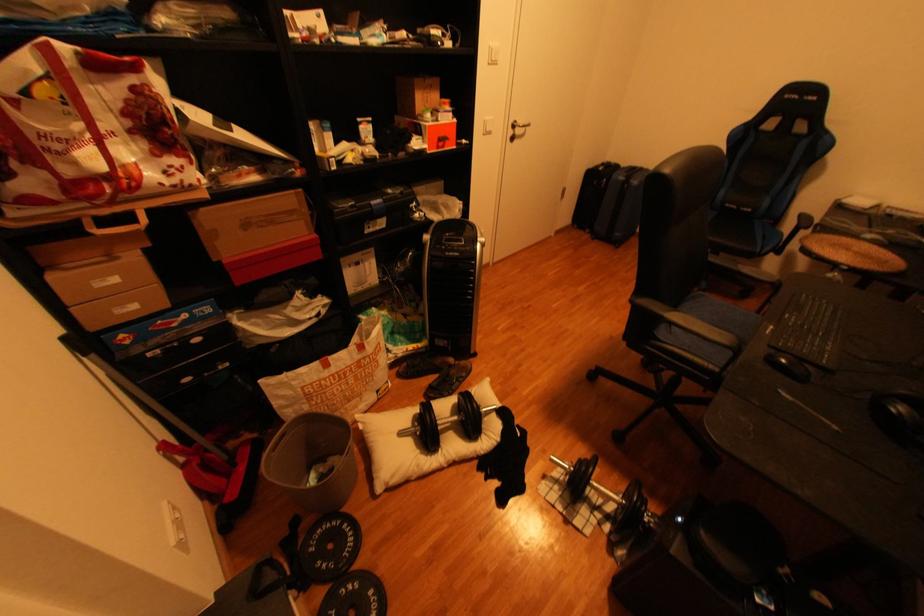
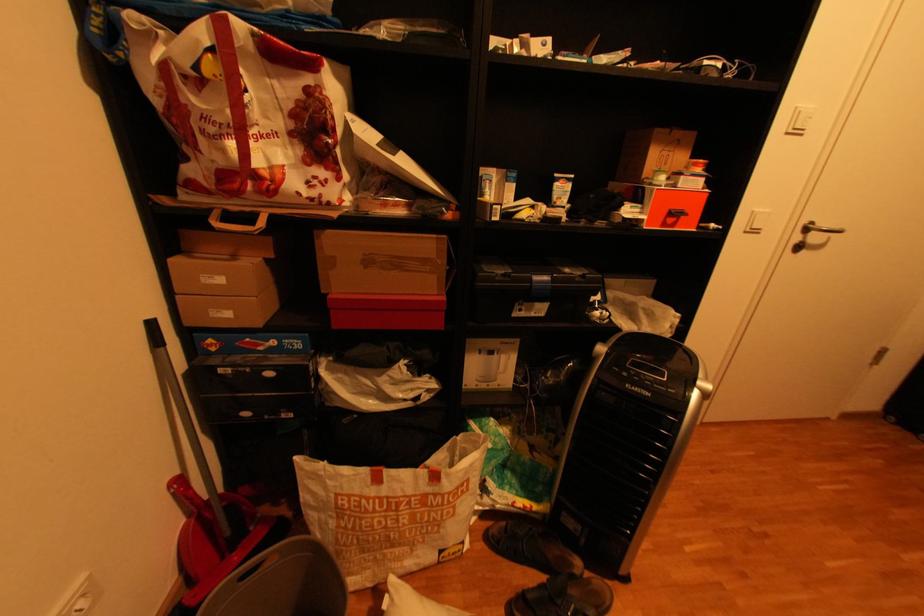
Where in the second image is the point corresponding to (x=494, y=118) from the first image?

(766, 209)